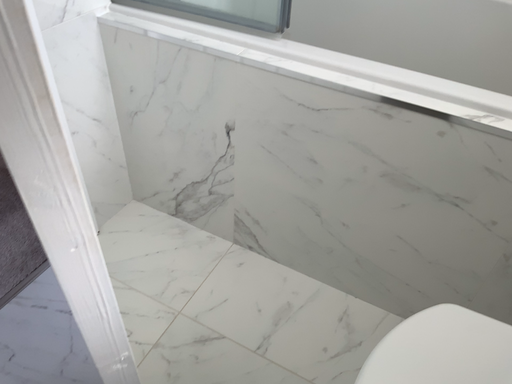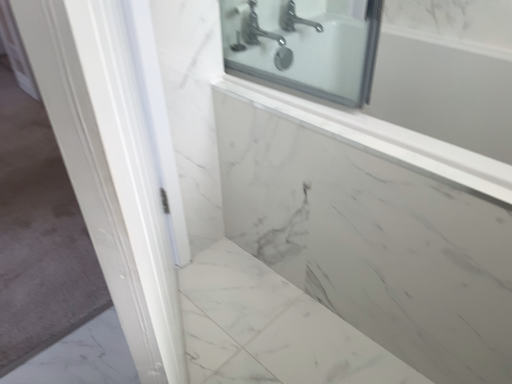
Question: Which way did the camera rotate in the video?

Choices:
 (A) rotated upward
 (B) rotated downward

Answer: (A)